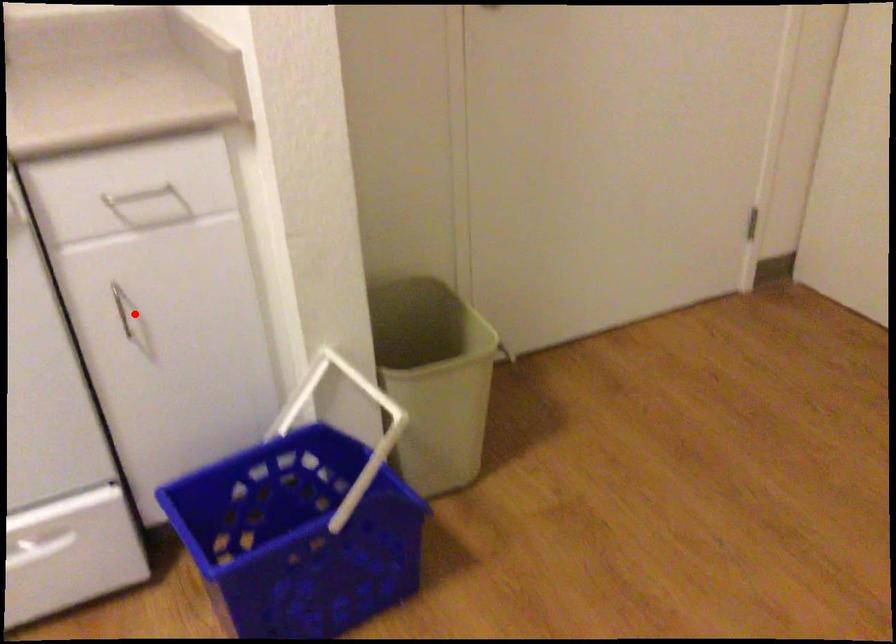
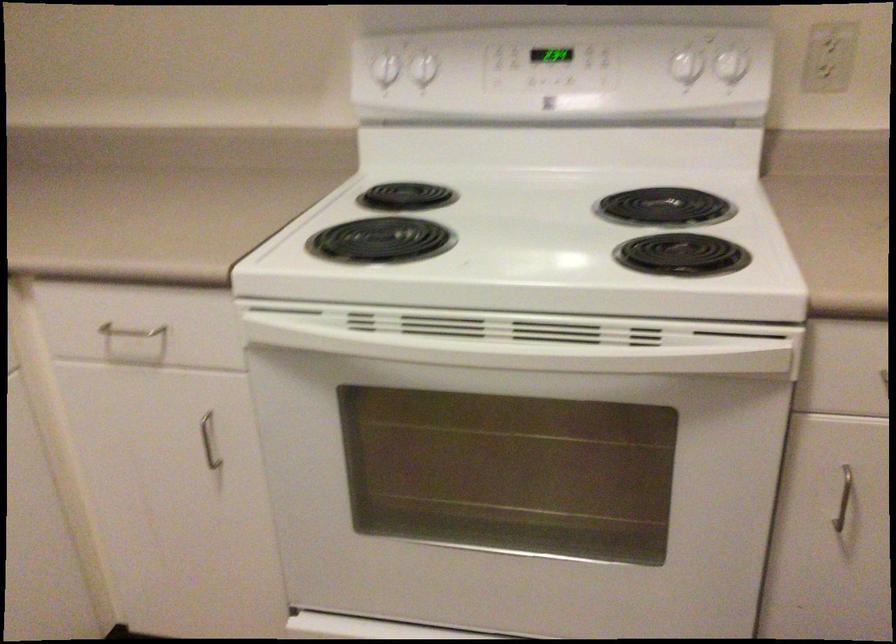
Question: I am providing you with two images of the same scene from different viewpoints. In image1, a red point is highlighted. Considering the same 3D point in image2, which of the following is correct?

Choices:
 (A) It is closer
 (B) It is farther

Answer: (A)